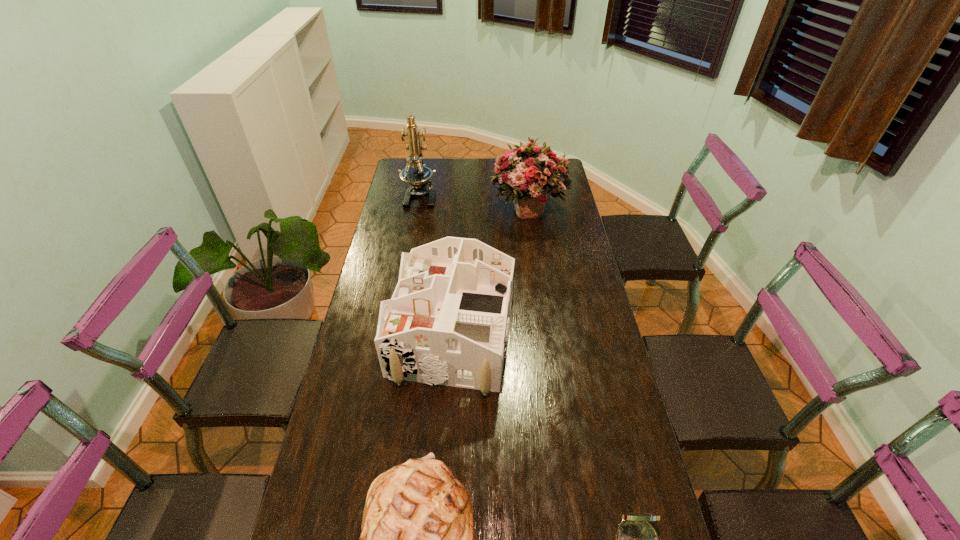
Find the location of a particular element. The height and width of the screenshot is (540, 960). object situated at the right edge is located at coordinates (527, 173).

At what (x,y) coordinates should I click in order to perform the action: click on object positioned at the far left corner. Please return your answer as a coordinate pair (x, y). Looking at the image, I should click on (419, 176).

Where is `vacant space at the left edge`? The height and width of the screenshot is (540, 960). vacant space at the left edge is located at coordinates [372, 295].

The image size is (960, 540). Identify the location of vacant space at the right edge of the desktop. (551, 284).

The image size is (960, 540). In the image, there is a desktop. Identify the location of vacant space at the far left corner. (399, 165).

Identify the location of unoccupied area between the bouquet and the microscope. (474, 202).

You are a GUI agent. You are given a task and a screenshot of the screen. Output one action in this format:
    pyautogui.click(x=<x>, y=<y>)
    Task: Click on the third closest object to the second tallest object
    Image resolution: width=960 pixels, height=540 pixels.
    Given the screenshot: What is the action you would take?
    pyautogui.click(x=418, y=539)

This screenshot has height=540, width=960. Find the location of `object that is the fourth nearest to the third nearest object`. object that is the fourth nearest to the third nearest object is located at coordinates (419, 176).

Identify the location of blank area in the image that satisfies the following two spatial constraints: 1. at the eyepiece of the microscope; 2. on the right side of the dollhouse. The width and height of the screenshot is (960, 540). pos(396,337).